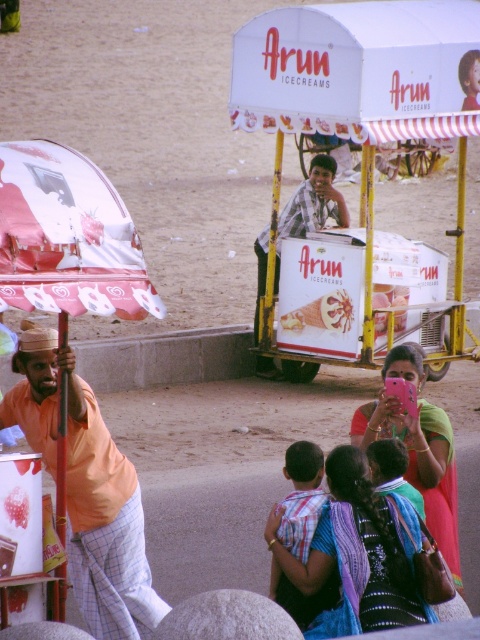
Can you confirm if orange cotton shirt at left is bigger than blue fabric sari at lower center?

Yes, orange cotton shirt at left is bigger than blue fabric sari at lower center.

Locate an element on the screen. This screenshot has height=640, width=480. orange cotton shirt at left is located at coordinates (86, 490).

Is point (398, 525) positioned in front of point (427, 422)?

Yes, it is in front of point (427, 422).

How much distance is there between blue fabric sari at lower center and matte pink phone at center?

blue fabric sari at lower center is 26.68 inches away from matte pink phone at center.

Does point (335, 513) come behind point (431, 460)?

No, (335, 513) is in front of (431, 460).

What are the coordinates of `blue fabric sari at lower center` in the screenshot? It's located at (359, 554).

Measure the distance between orange cotton shirt at left and camera.

They are 6.23 meters apart.

Which is more to the left, orange cotton shirt at left or matte pink phone at center?

orange cotton shirt at left is more to the left.

Locate an element on the screen. orange cotton shirt at left is located at coordinates (86, 490).